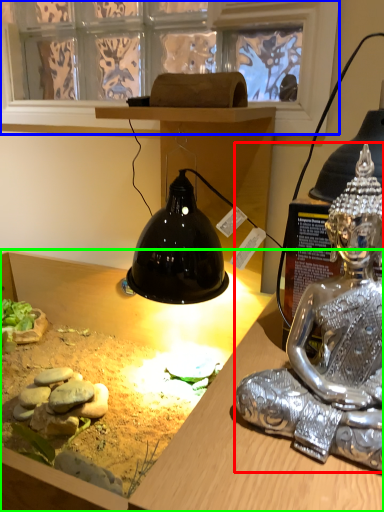
Question: Which object is positioned farthest from person (highlighted by a red box)? Select from window screen (highlighted by a blue box) and desk (highlighted by a green box).

Choices:
 (A) window screen
 (B) desk

Answer: (A)